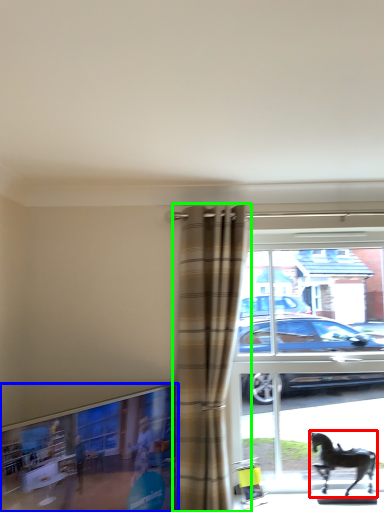
Question: Based on their relative distances, which object is nearer to horse (highlighted by a red box)? Choose from window frame (highlighted by a blue box) and curtain (highlighted by a green box).

Choices:
 (A) window frame
 (B) curtain

Answer: (B)